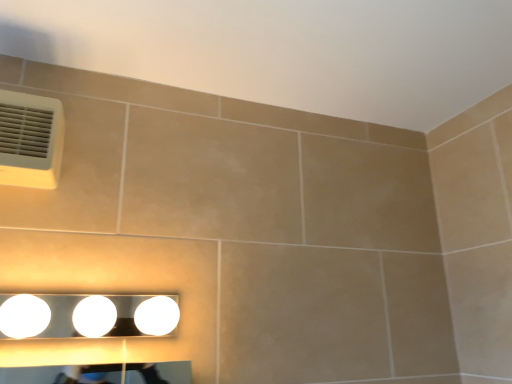
Question: From the image's perspective, is white plastic air conditioning at upper left below white glossy light fixture at lower center?

Choices:
 (A) yes
 (B) no

Answer: (B)

Question: Is white plastic air conditioning at upper left not close to white glossy light fixture at lower center?

Choices:
 (A) yes
 (B) no

Answer: (B)

Question: Does white plastic air conditioning at upper left have a smaller size compared to white glossy light fixture at lower center?

Choices:
 (A) yes
 (B) no

Answer: (A)

Question: Is white plastic air conditioning at upper left thinner than white glossy light fixture at lower center?

Choices:
 (A) yes
 (B) no

Answer: (A)

Question: Is white plastic air conditioning at upper left next to white glossy light fixture at lower center and touching it?

Choices:
 (A) yes
 (B) no

Answer: (B)

Question: From the image's perspective, is white plastic air conditioning at upper left on top of white glossy light fixture at lower center?

Choices:
 (A) no
 (B) yes

Answer: (B)

Question: Is white glossy light fixture at lower center oriented towards white plastic air conditioning at upper left?

Choices:
 (A) no
 (B) yes

Answer: (A)

Question: Considering the relative positions of white glossy light fixture at lower center and white plastic air conditioning at upper left in the image provided, is white glossy light fixture at lower center in front of white plastic air conditioning at upper left?

Choices:
 (A) no
 (B) yes

Answer: (B)

Question: Is white plastic air conditioning at upper left inside white glossy light fixture at lower center?

Choices:
 (A) no
 (B) yes

Answer: (A)

Question: Can you confirm if white glossy light fixture at lower center is smaller than white plastic air conditioning at upper left?

Choices:
 (A) no
 (B) yes

Answer: (A)

Question: Considering the relative sizes of white glossy light fixture at lower center and white plastic air conditioning at upper left in the image provided, is white glossy light fixture at lower center thinner than white plastic air conditioning at upper left?

Choices:
 (A) yes
 (B) no

Answer: (B)

Question: Can you confirm if white glossy light fixture at lower center is taller than white plastic air conditioning at upper left?

Choices:
 (A) yes
 (B) no

Answer: (B)

Question: Would you say white glossy light fixture at lower center is to the left or to the right of white plastic air conditioning at upper left in the picture?

Choices:
 (A) left
 (B) right

Answer: (B)